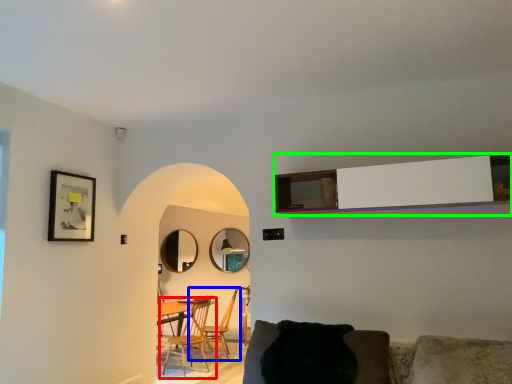
Question: Considering the real-world distances, which object is farthest from chair (highlighted by a red box)? chair (highlighted by a blue box) or cabinetry (highlighted by a green box)?

Choices:
 (A) chair
 (B) cabinetry

Answer: (B)